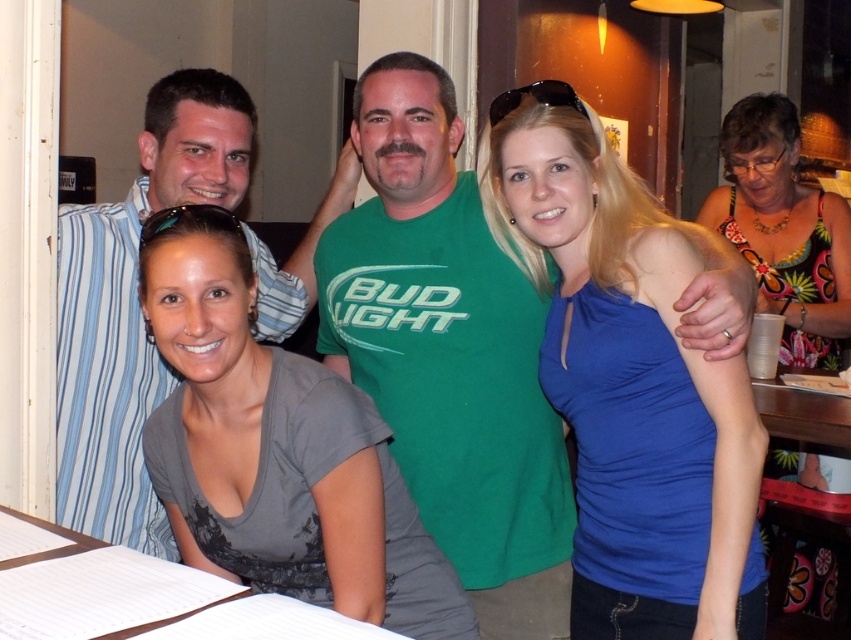
Is gray fabric shirt at lower left to the right of white paper at lower left from the viewer's perspective?

Correct, you'll find gray fabric shirt at lower left to the right of white paper at lower left.

In the scene shown: Is gray fabric shirt at lower left thinner than white paper at lower left?

Yes, gray fabric shirt at lower left is thinner than white paper at lower left.

At what (x,y) coordinates should I click in order to perform the action: click on gray fabric shirt at lower left. Please return your answer as a coordinate pair (x, y). Looking at the image, I should click on (277, 451).

Does matte blue shirt at center appear on the right side of white paper at lower left?

Incorrect, matte blue shirt at center is not on the right side of white paper at lower left.

Can you confirm if matte blue shirt at center is smaller than white paper at lower left?

No, matte blue shirt at center is not smaller than white paper at lower left.

Image resolution: width=851 pixels, height=640 pixels. What do you see at coordinates (133, 305) in the screenshot? I see `matte blue shirt at center` at bounding box center [133, 305].

This screenshot has height=640, width=851. I want to click on matte blue shirt at center, so (x=133, y=305).

Which is behind, point (764, 259) or point (307, 627)?

Point (764, 259)

Is point (829, 234) behind point (90, 620)?

Yes, it is behind point (90, 620).

Is point (800, 348) farther from viewer compared to point (386, 630)?

Yes, it is.

Locate an element on the screen. This screenshot has width=851, height=640. floral tank top at upper right is located at coordinates (784, 228).